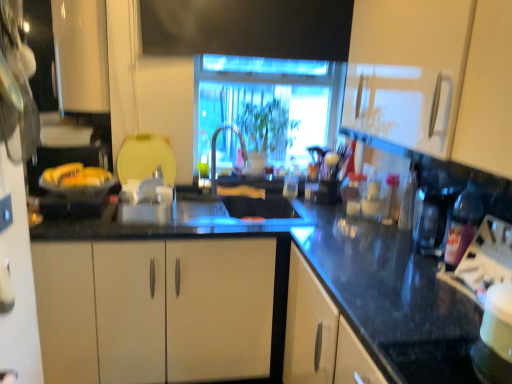
Question: Should I look upward or downward to see translucent plastic bottle at center, which is counted as the second bottle, starting from the front?

Choices:
 (A) up
 (B) down

Answer: (A)

Question: Does white glossy cabinet at upper left, which ranks as the 1th cabinetry in left-to-right order, have a lesser height compared to transparent glass window at center?

Choices:
 (A) yes
 (B) no

Answer: (B)

Question: Considering the relative sizes of white glossy cabinet at upper left, acting as the 2th cabinetry starting from the front, and transparent glass window at center in the image provided, is white glossy cabinet at upper left, acting as the 2th cabinetry starting from the front, thinner than transparent glass window at center?

Choices:
 (A) yes
 (B) no

Answer: (A)

Question: Can you confirm if white glossy cabinet at upper left, acting as the 1th cabinetry starting from the back, is taller than transparent glass window at center?

Choices:
 (A) no
 (B) yes

Answer: (B)

Question: Does white glossy cabinet at upper left, acting as the 2th cabinetry starting from the front, have a smaller size compared to transparent glass window at center?

Choices:
 (A) yes
 (B) no

Answer: (A)

Question: Is white glossy cabinet at upper left, which ranks as the 1th cabinetry in left-to-right order, not close to transparent glass window at center?

Choices:
 (A) no
 (B) yes

Answer: (A)

Question: From the image's perspective, is white glossy cabinet at upper left, which ranks as the 1th cabinetry in left-to-right order, on transparent glass window at center?

Choices:
 (A) yes
 (B) no

Answer: (A)

Question: Is the position of translucent plastic bottle at center, placed as the first bottle when sorted from top to bottom, less distant than that of satin nickel faucet at center?

Choices:
 (A) yes
 (B) no

Answer: (B)

Question: Considering the relative sizes of translucent plastic bottle at center, which appears as the second bottle when viewed from the right, and satin nickel faucet at center in the image provided, is translucent plastic bottle at center, which appears as the second bottle when viewed from the right, taller than satin nickel faucet at center?

Choices:
 (A) yes
 (B) no

Answer: (B)

Question: Is translucent plastic bottle at center, placed as the first bottle when sorted from top to bottom, at the left side of satin nickel faucet at center?

Choices:
 (A) yes
 (B) no

Answer: (B)

Question: From the image's perspective, is translucent plastic bottle at center, which ranks as the 1th bottle in back-to-front order, located above satin nickel faucet at center?

Choices:
 (A) yes
 (B) no

Answer: (B)

Question: From a real-world perspective, is translucent plastic bottle at center, which is counted as the second bottle, starting from the front, on top of satin nickel faucet at center?

Choices:
 (A) yes
 (B) no

Answer: (B)

Question: From the image's perspective, is translucent plastic bottle at center, which ranks as the 1th bottle in back-to-front order, located beneath satin nickel faucet at center?

Choices:
 (A) yes
 (B) no

Answer: (A)

Question: From the image's perspective, is transparent glass window at center on translucent plastic bottle at center, which ranks as the 1th bottle in back-to-front order?

Choices:
 (A) yes
 (B) no

Answer: (A)